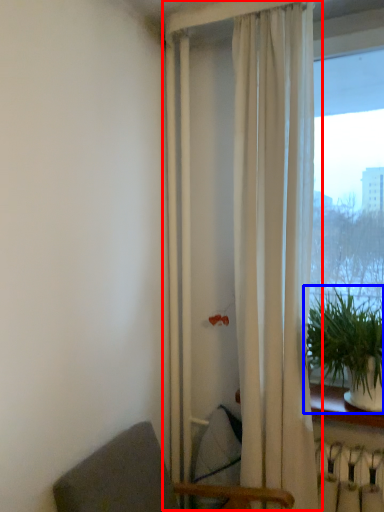
Question: Which of the following is the farthest to the observer, curtain (highlighted by a red box) or houseplant (highlighted by a blue box)?

Choices:
 (A) curtain
 (B) houseplant

Answer: (A)